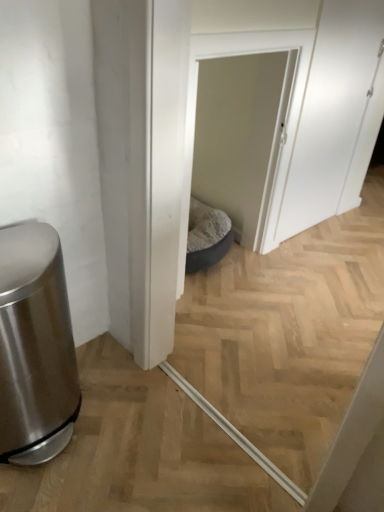
Identify the location of free point above white fabric pet bed at center, arranged as the 1th screen door when viewed from the left (from a real-world perspective). This screenshot has height=512, width=384. (263, 30).